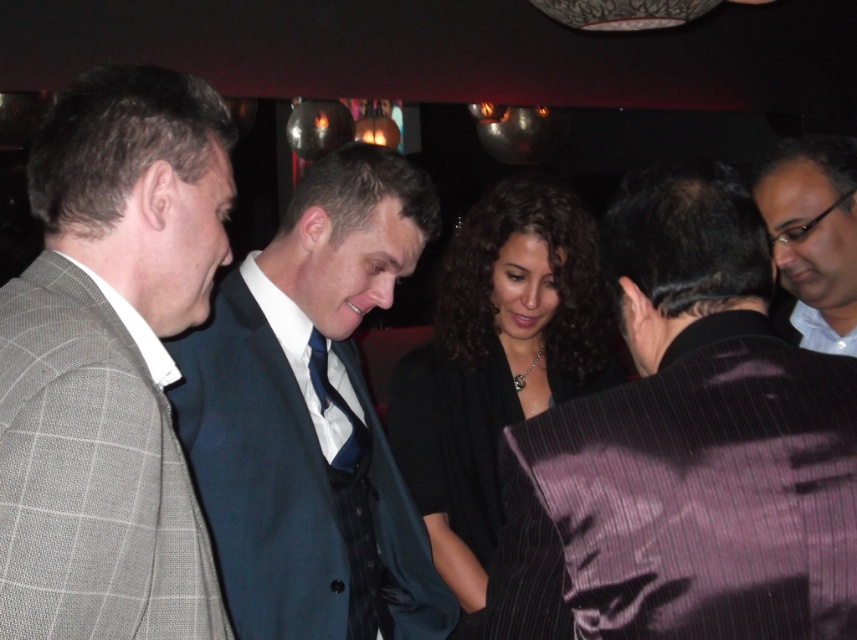
You are a photographer at the event and need to capture a photo that includes both the black silk dress at center and the white glossy shirt at upper right. What is the minimum distance you should set your camera to ensure both are in focus?

The black silk dress at center is 19.55 inches away from the white glossy shirt at upper right. To ensure both are in focus, the camera should be set to a depth of field that covers this distance.

You are organizing a photo shoot and need to ensure that the dark purple pinstripe suit at center and the white glossy shirt at upper right are both visible in the frame. Given their sizes, which of these two items requires more horizontal space to fully capture in the photograph?

The dark purple pinstripe suit at center requires more horizontal space because its width surpasses that of the white glossy shirt at upper right.